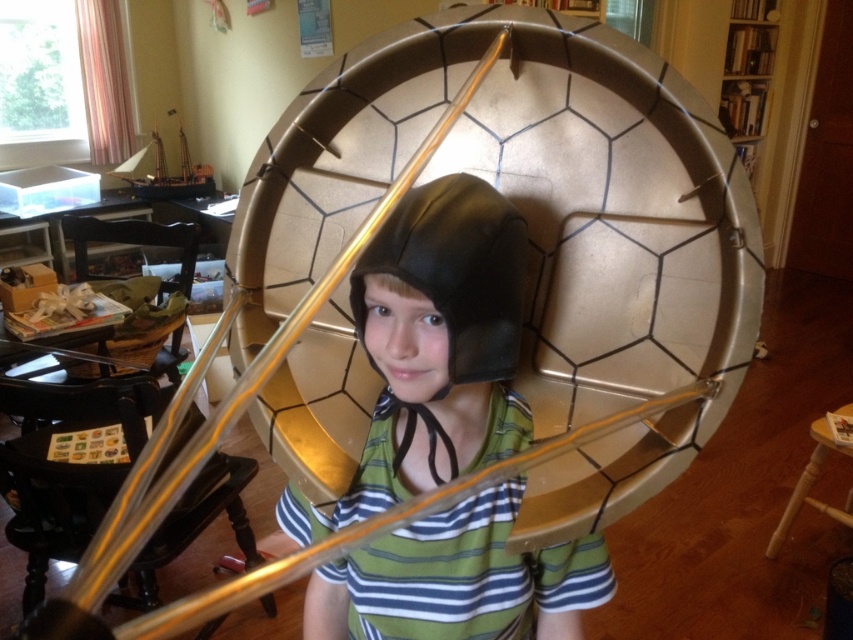
Question: Which point is closer to the camera taking this photo?

Choices:
 (A) (427, 324)
 (B) (474, 362)

Answer: (A)

Question: Can you confirm if matte black helmet at center is positioned to the right of black leather helmet at center?

Choices:
 (A) no
 (B) yes

Answer: (B)

Question: Which point appears closest to the camera in this image?

Choices:
 (A) (398, 276)
 (B) (473, 232)

Answer: (A)

Question: Is matte black helmet at center below black leather helmet at center?

Choices:
 (A) yes
 (B) no

Answer: (A)

Question: Is matte black helmet at center to the left of black leather helmet at center from the viewer's perspective?

Choices:
 (A) yes
 (B) no

Answer: (B)